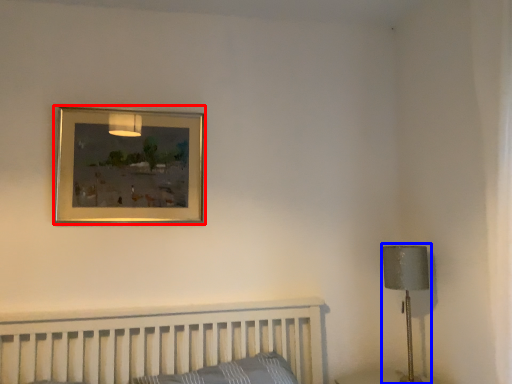
Question: Which object is closer to the camera taking this photo, picture frame (highlighted by a red box) or table lamp (highlighted by a blue box)?

Choices:
 (A) picture frame
 (B) table lamp

Answer: (B)